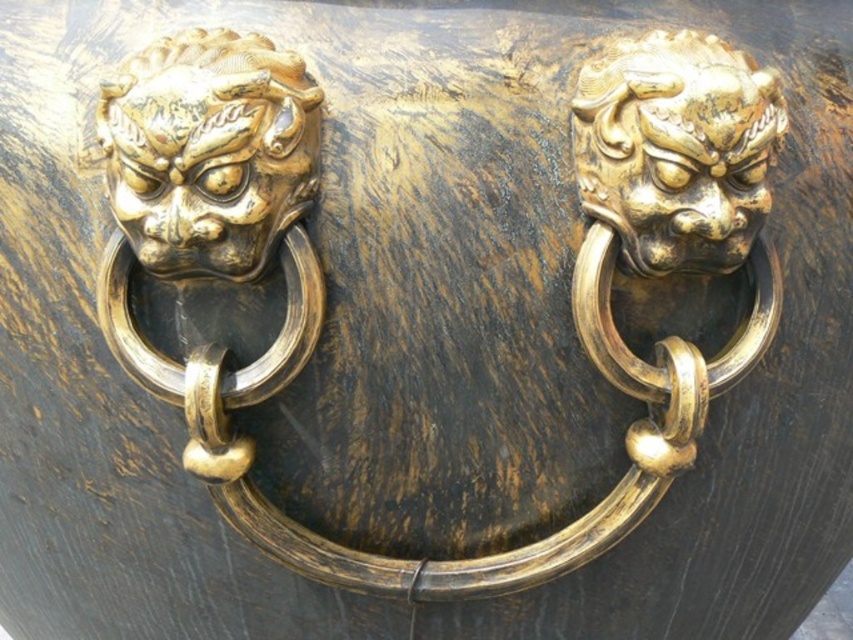
Does gold polished lion head at left lie in front of gold polished lion head at upper right?

That is True.

Does gold polished lion head at left come behind gold polished lion head at upper right?

No.

Who is more distant from viewer, (306, 188) or (653, 92)?

The point (306, 188) is more distant.

The height and width of the screenshot is (640, 853). Identify the location of gold polished lion head at left. (207, 150).